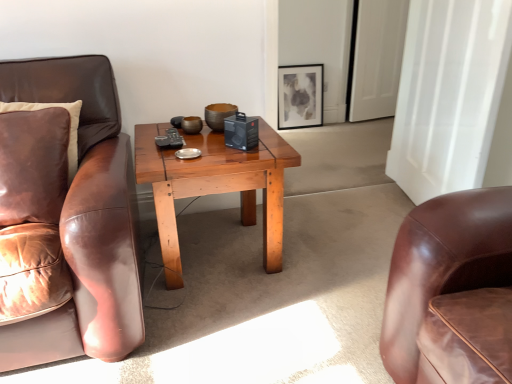
You are a GUI agent. You are given a task and a screenshot of the screen. Output one action in this format:
    pyautogui.click(x=<x>, y=<y>)
    Task: Click on the free point to the right of wooden coffee table at center
    The height and width of the screenshot is (384, 512).
    Given the screenshot: What is the action you would take?
    pyautogui.click(x=331, y=253)